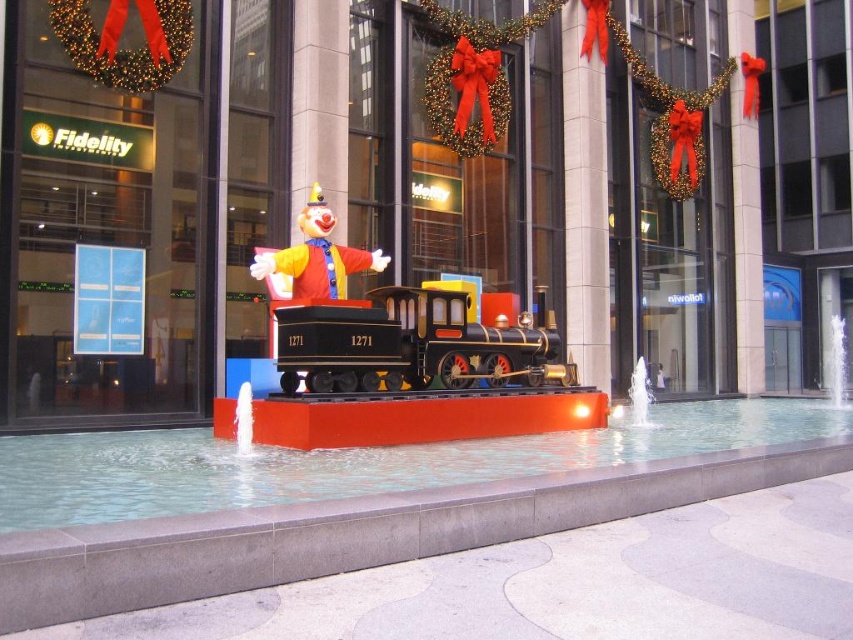
You are a delivery person who needs to place a 15 feet long box between the metallic clown at center and the shiny black locomotive at center. Can you fit the box between them without moving either object?

The metallic clown at center and shiny black locomotive at center are 20.60 feet apart from each other. Since the box is 15 feet long, it can fit between them as the distance between the two objects is greater than the box length.

You are standing in front of the festive display and want to take a photo of the metallic clown at center and the white marble pillar at center. Which object will appear larger in your photo?

The metallic clown at center will appear larger in the photo because it is closer to the viewer than the white marble pillar at center.